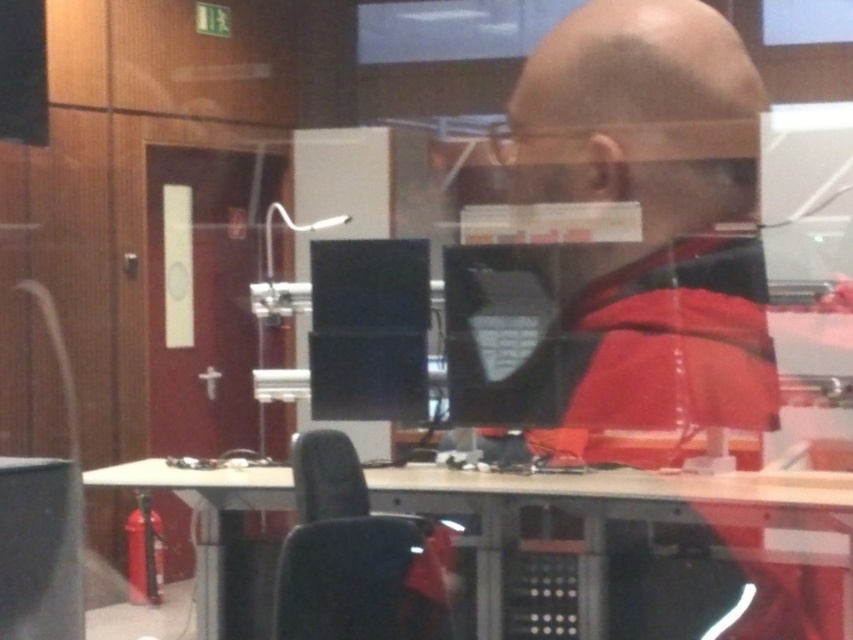
Question: Is wooden table at center closer to the viewer compared to black fabric chair at lower center?

Choices:
 (A) no
 (B) yes

Answer: (A)

Question: Among these objects, which one is nearest to the camera?

Choices:
 (A) wooden table at center
 (B) black fabric chair at lower center

Answer: (B)

Question: Which point is farther to the camera?

Choices:
 (A) black fabric chair at lower center
 (B) wooden table at center

Answer: (B)

Question: Can you confirm if wooden table at center is positioned below black fabric chair at lower center?

Choices:
 (A) no
 (B) yes

Answer: (B)

Question: Does wooden table at center have a greater width compared to black fabric chair at lower center?

Choices:
 (A) no
 (B) yes

Answer: (B)